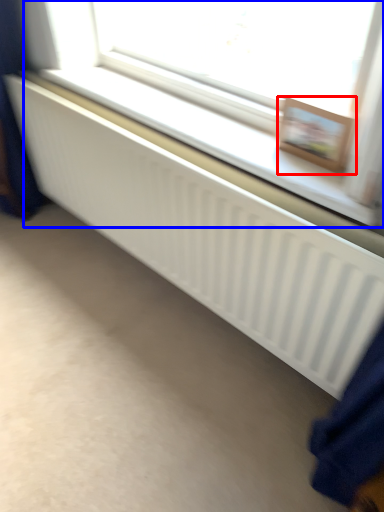
Question: Which object appears closest to the camera in this image, picture frame (highlighted by a red box) or bay window (highlighted by a blue box)?

Choices:
 (A) picture frame
 (B) bay window

Answer: (B)